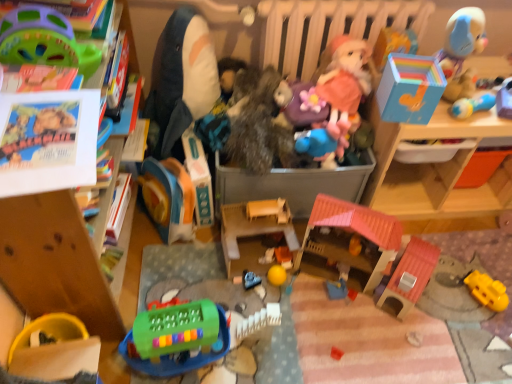
You are a GUI agent. You are given a task and a screenshot of the screen. Output one action in this format:
    pyautogui.click(x=<x>, y=<y>)
    Task: Click on the free space to the right of smooth blue car at center, arranged as the sixth toy when viewed from the left
    The height and width of the screenshot is (384, 512).
    Given the screenshot: What is the action you would take?
    pyautogui.click(x=292, y=286)